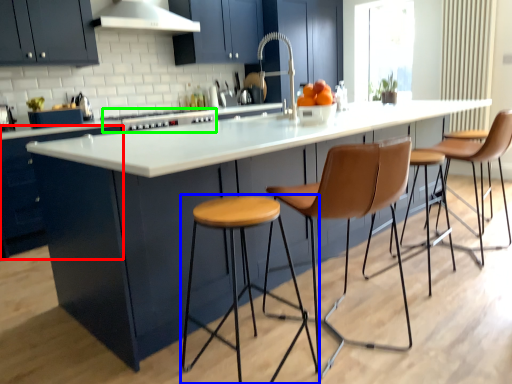
Question: Estimate the real-world distances between objects in this image. Which object is farther from cabinetry (highlighted by a red box), stool (highlighted by a blue box) or stove (highlighted by a green box)?

Choices:
 (A) stool
 (B) stove

Answer: (A)